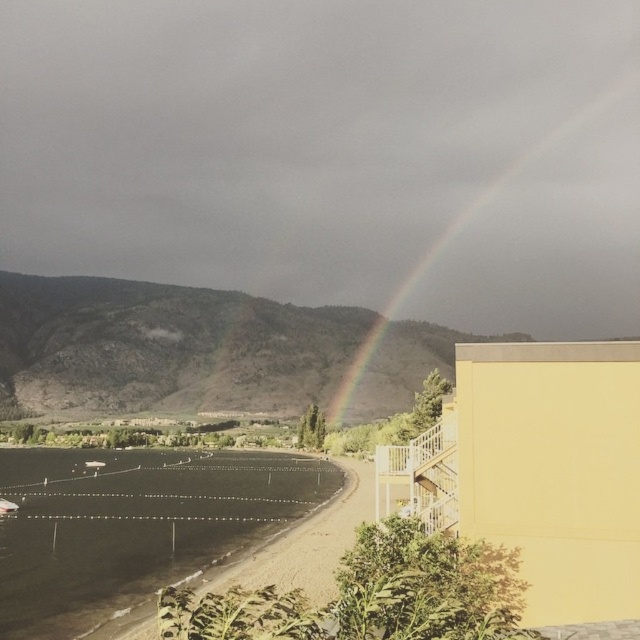
Which of these two, black asphalt runway at lower left or rainbow at upper right, stands taller?

With more height is rainbow at upper right.

This screenshot has width=640, height=640. What do you see at coordinates (301, 544) in the screenshot?
I see `black asphalt runway at lower left` at bounding box center [301, 544].

Is point (307, 573) positioned behind point (432, 244)?

No, it is not.

Locate an element on the screen. The width and height of the screenshot is (640, 640). black asphalt runway at lower left is located at coordinates (301, 544).